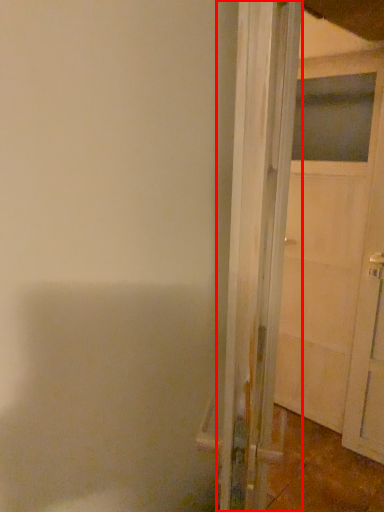
Question: Observing the image, what is the correct spatial positioning of door (annotated by the red box) in reference to door?

Choices:
 (A) right
 (B) left

Answer: (B)